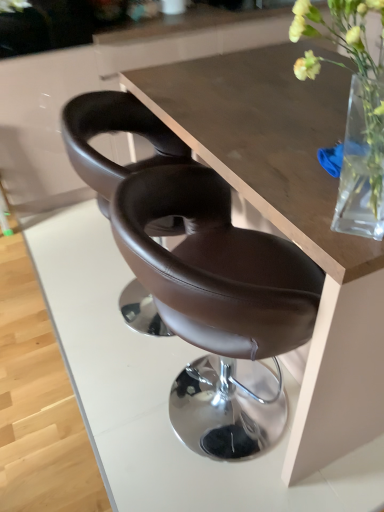
This screenshot has width=384, height=512. Identify the location of free spot behind translucent glass vase at upper right. (283, 156).